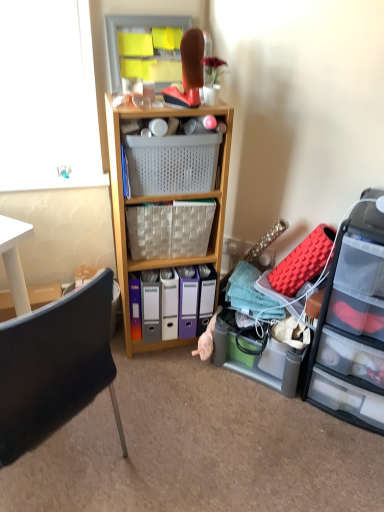
Question: Is the position of clear plastic drawers at right more distant than that of wooden shelf at center?

Choices:
 (A) no
 (B) yes

Answer: (A)

Question: Is clear plastic drawers at right surrounding wooden shelf at center?

Choices:
 (A) yes
 (B) no

Answer: (B)

Question: From a real-world perspective, is clear plastic drawers at right located beneath wooden shelf at center?

Choices:
 (A) no
 (B) yes

Answer: (B)

Question: Is the position of clear plastic drawers at right less distant than that of wooden shelf at center?

Choices:
 (A) yes
 (B) no

Answer: (A)

Question: Is clear plastic drawers at right thinner than wooden shelf at center?

Choices:
 (A) no
 (B) yes

Answer: (A)

Question: From the image's perspective, is wooden shelf at center located above or below clear plastic drawers at right?

Choices:
 (A) above
 (B) below

Answer: (A)

Question: In the image, is wooden shelf at center on the left side or the right side of clear plastic drawers at right?

Choices:
 (A) left
 (B) right

Answer: (A)

Question: Is point (178, 111) closer or farther from the camera than point (324, 373)?

Choices:
 (A) closer
 (B) farther

Answer: (A)

Question: Relative to clear plastic drawers at right, is wooden shelf at center in front or behind?

Choices:
 (A) behind
 (B) front

Answer: (A)

Question: From the image's perspective, is woven fabric picnic basket at center, which ranks as the 2th picnic basket in top-to-bottom order, located above or below plastic mesh basket at center, placed as the first picnic basket when sorted from top to bottom?

Choices:
 (A) below
 (B) above

Answer: (A)

Question: Does point (155, 203) appear closer or farther from the camera than point (195, 146)?

Choices:
 (A) closer
 (B) farther

Answer: (B)

Question: Looking at the image, does woven fabric picnic basket at center, which ranks as the 2th picnic basket in top-to-bottom order, seem bigger or smaller compared to plastic mesh basket at center, which is counted as the 2th picnic basket, starting from the bottom?

Choices:
 (A) small
 (B) big

Answer: (B)

Question: Would you say woven fabric picnic basket at center, which ranks as the 2th picnic basket in top-to-bottom order, is inside or outside plastic mesh basket at center, placed as the first picnic basket when sorted from top to bottom?

Choices:
 (A) inside
 (B) outside

Answer: (B)

Question: From their relative heights in the image, would you say woven fabric picnic basket at center, the first picnic basket positioned from the bottom, is taller or shorter than clear plastic drawers at right?

Choices:
 (A) tall
 (B) short

Answer: (B)

Question: Considering the positions of woven fabric picnic basket at center, which ranks as the 2th picnic basket in top-to-bottom order, and clear plastic drawers at right in the image, is woven fabric picnic basket at center, which ranks as the 2th picnic basket in top-to-bottom order, wider or thinner than clear plastic drawers at right?

Choices:
 (A) thin
 (B) wide

Answer: (A)